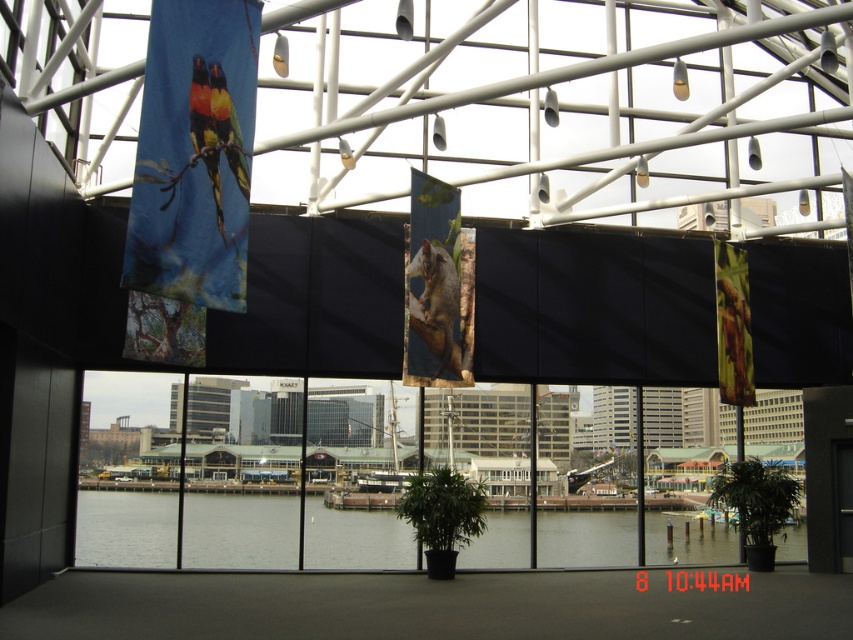
Question: Is clear water at lower center wider than multicolored fabric parrot at upper left?

Choices:
 (A) no
 (B) yes

Answer: (B)

Question: Is blue fabric birds at left bigger than clear water at lower center?

Choices:
 (A) no
 (B) yes

Answer: (A)

Question: Can you confirm if blue fabric birds at left is bigger than clear water at lower center?

Choices:
 (A) no
 (B) yes

Answer: (A)

Question: Which object appears farthest from the camera in this image?

Choices:
 (A) multicolored fabric parrot at upper left
 (B) clear water at lower center
 (C) blue fabric birds at left

Answer: (B)

Question: Which point is farther to the camera?

Choices:
 (A) (196, 136)
 (B) (187, 280)

Answer: (A)

Question: Which object is the farthest from the blue fabric birds at left?

Choices:
 (A) clear water at lower center
 (B) multicolored fabric parrot at upper left

Answer: (A)